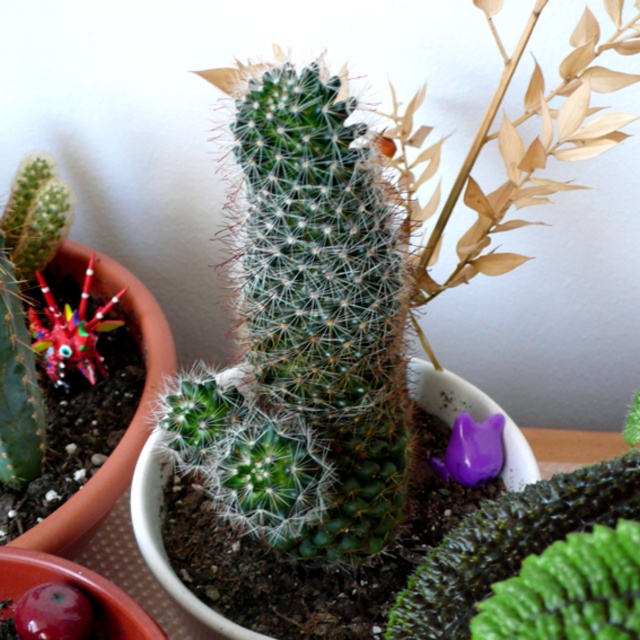
Question: Considering the relative positions of multicolored plastic flower at left and purple matte cat at lower right in the image provided, where is multicolored plastic flower at left located with respect to purple matte cat at lower right?

Choices:
 (A) left
 (B) right

Answer: (A)

Question: Which of the following is the closest to the observer?

Choices:
 (A) (493, 435)
 (B) (88, 349)
 (C) (88, 616)

Answer: (C)

Question: Which object is the farthest from the purple matte cat at lower right?

Choices:
 (A) glossy plastic flower at center
 (B) multicolored plastic flower at left

Answer: (B)

Question: Can you confirm if multicolored plastic flower at left is positioned to the left of glossy plastic flower at center?

Choices:
 (A) yes
 (B) no

Answer: (A)

Question: Is glossy plastic flower at center to the right of purple matte cat at lower right from the viewer's perspective?

Choices:
 (A) yes
 (B) no

Answer: (B)

Question: Which of the following is the closest to the observer?

Choices:
 (A) multicolored plastic flower at left
 (B) purple matte cat at lower right
 (C) glossy plastic flower at center

Answer: (C)